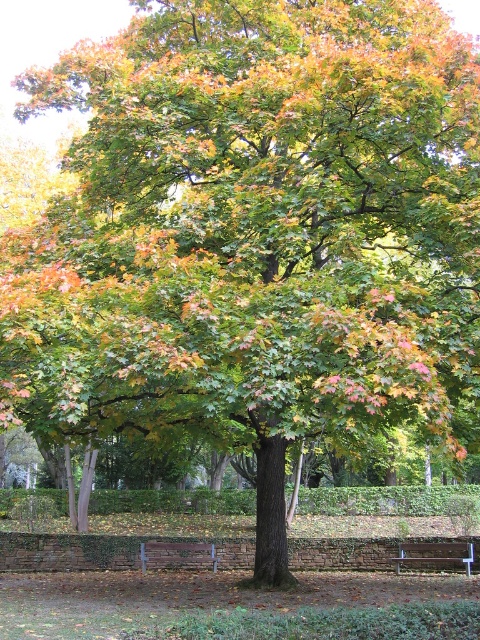
You are sitting on the wooden bench at lower right and want to move to the brown wooden bench at lower center. Which direction should you go to reach it?

Since the wooden bench at lower right is in front of the brown wooden bench at lower center, you should move backward to reach the brown wooden bench at lower center.

You are standing in the park and see the point marked at coordinates (232, 579). What object does this point correspond to?

The point at coordinates (232, 579) corresponds to the green leafy tree at center.